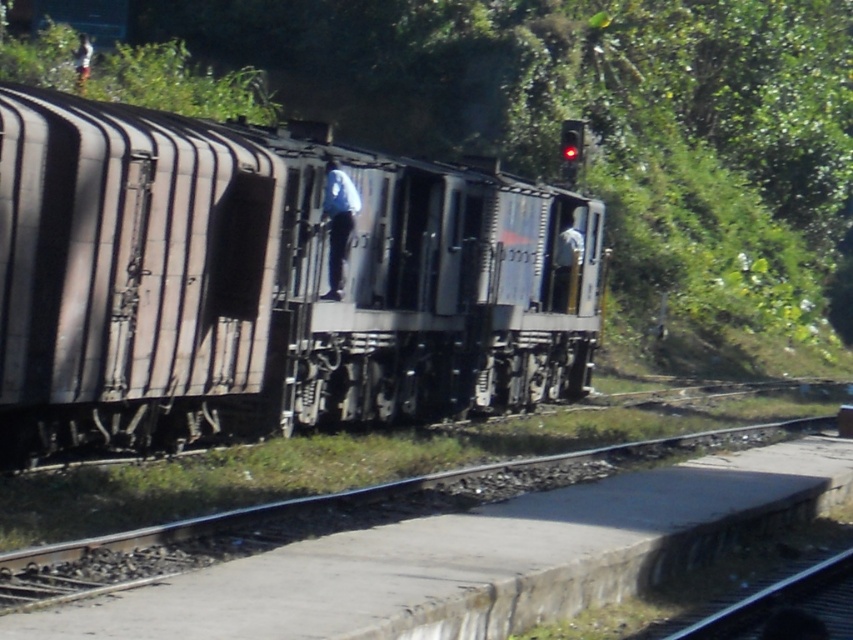
Question: Which of the following is the farthest from the observer?

Choices:
 (A) (56, 556)
 (B) (419, 416)

Answer: (B)

Question: Does rusty metal train at center come behind smooth concrete platform at lower center?

Choices:
 (A) yes
 (B) no

Answer: (A)

Question: Among these points, which one is nearest to the camera?

Choices:
 (A) tap(387, 212)
 (B) tap(529, 467)

Answer: (B)

Question: Is the position of rusty metal train at center less distant than that of smooth concrete platform at lower center?

Choices:
 (A) yes
 (B) no

Answer: (B)

Question: Is rusty metal train at center below smooth concrete platform at lower center?

Choices:
 (A) yes
 (B) no

Answer: (B)